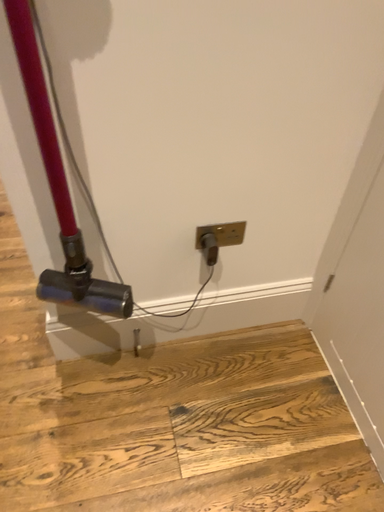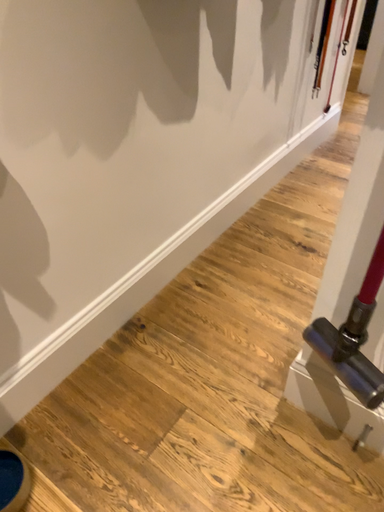
Question: Which way did the camera rotate in the video?

Choices:
 (A) rotated right
 (B) rotated left

Answer: (B)